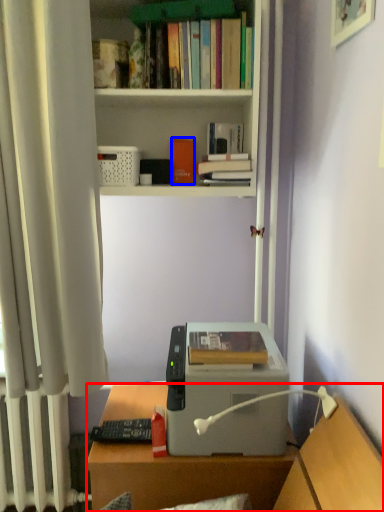
Question: Which object appears closest to the camera in this image, desk (highlighted by a red box) or paperback book (highlighted by a blue box)?

Choices:
 (A) desk
 (B) paperback book

Answer: (A)